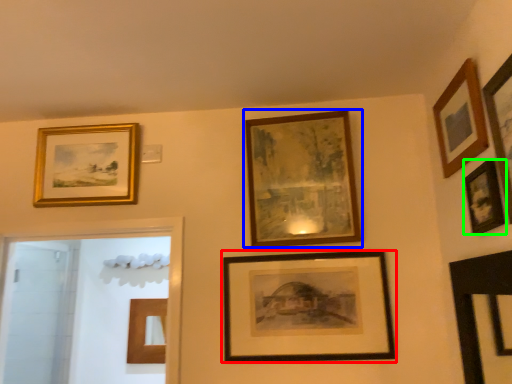
Question: Which is nearer to the picture frame (highlighted by a red box)? picture frame (highlighted by a blue box) or picture frame (highlighted by a green box).

Choices:
 (A) picture frame
 (B) picture frame

Answer: (A)